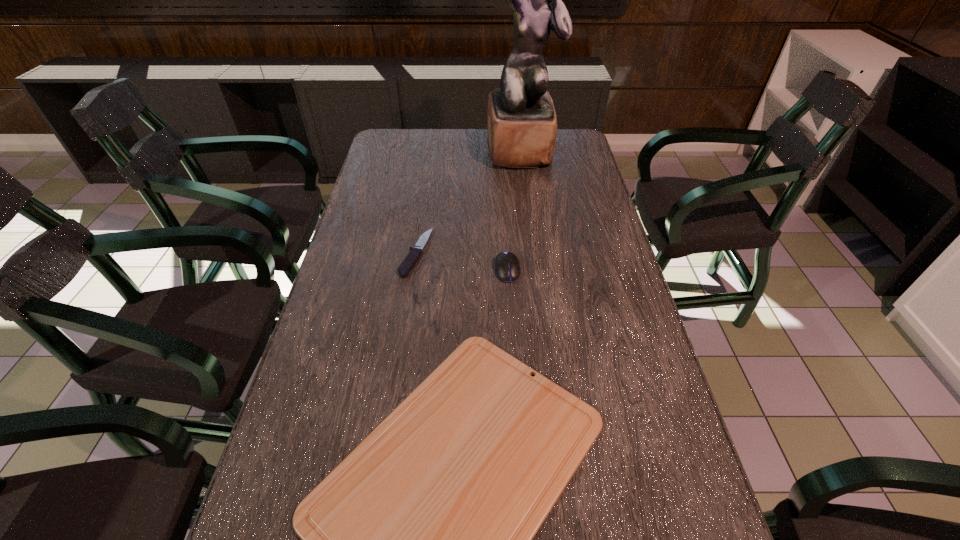
Find the location of a particular element. vacant region that satisfies the following two spatial constraints: 1. on the front side of the computer mouse; 2. on the right side of the steak knife is located at coordinates (414, 270).